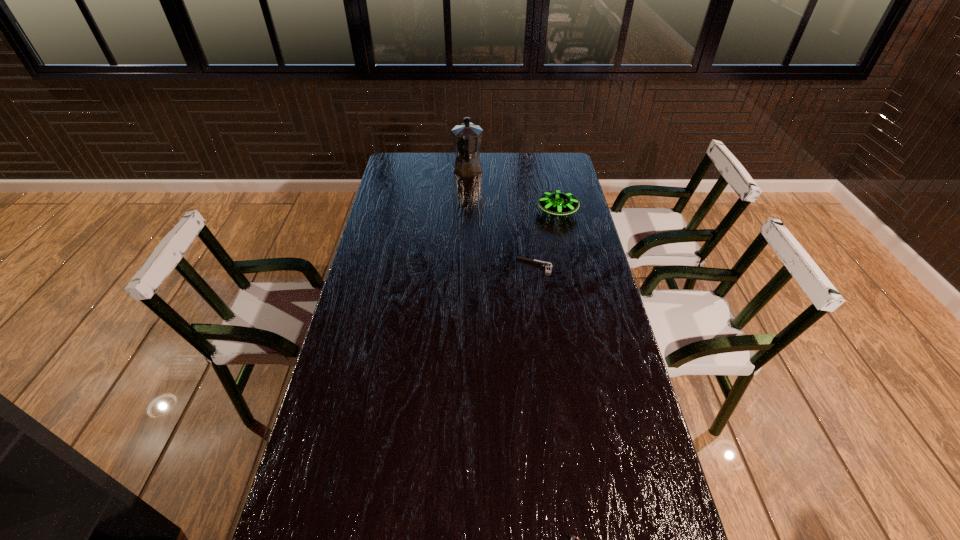
In order to click on object that is at the far edge in this screenshot , I will do `click(467, 137)`.

Identify the location of object situated at the right edge. This screenshot has height=540, width=960. (556, 202).

What are the coordinates of `free space at the far edge` in the screenshot? It's located at 460,178.

I want to click on free location at the left edge, so click(330, 523).

Where is `vacant region at the right edge of the desktop`? The image size is (960, 540). vacant region at the right edge of the desktop is located at coordinates (569, 279).

Locate an element on the screen. vacant point at the far left corner is located at coordinates (394, 160).

Locate an element on the screen. This screenshot has width=960, height=540. free space between the pistol and the tallest object is located at coordinates (501, 219).

Where is `free space between the saucer and the farthest object`? The image size is (960, 540). free space between the saucer and the farthest object is located at coordinates click(x=513, y=192).

Identify the location of empty space that is in between the tallest object and the second farthest object. (513, 192).

Identify the location of free spot between the tallest object and the shortest object. (501, 219).